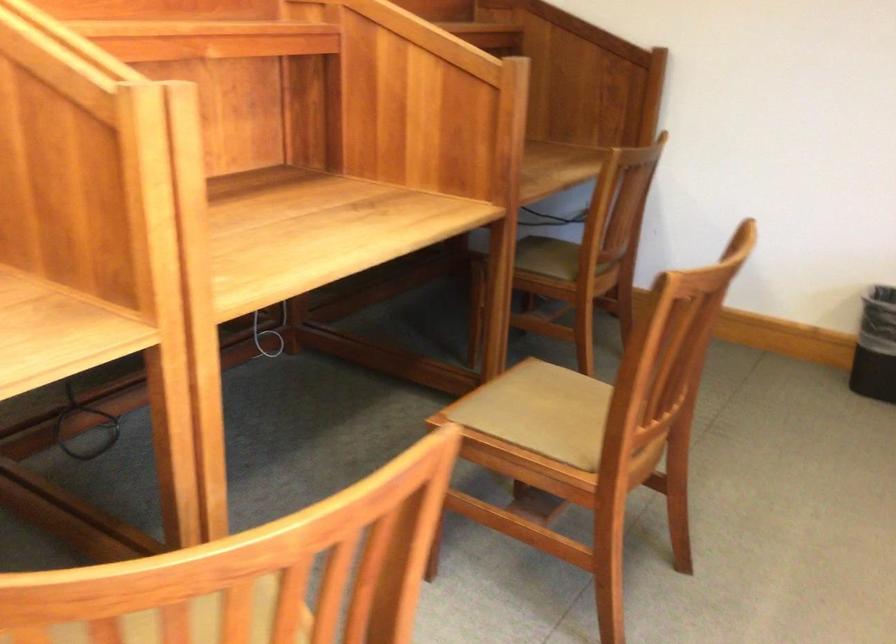
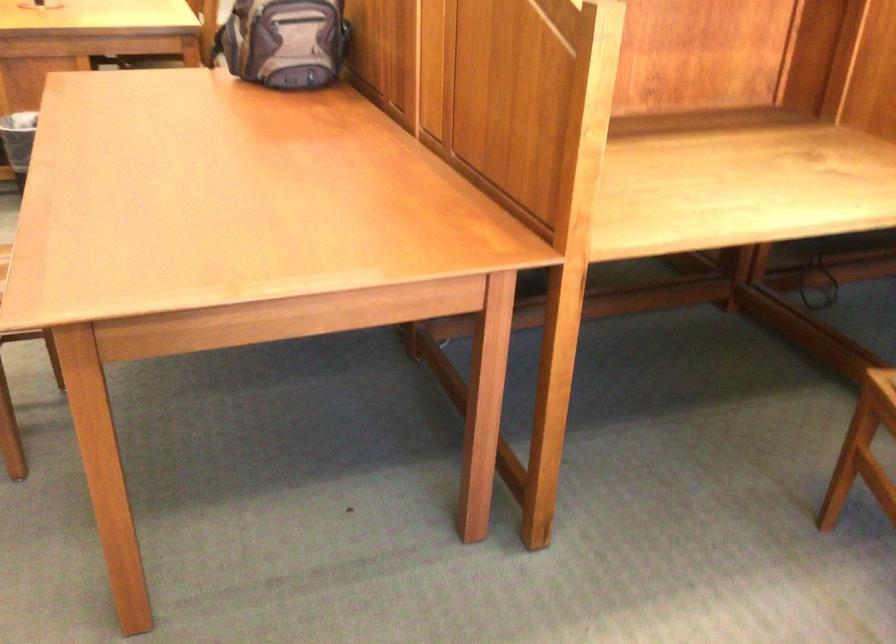
Question: The camera is either moving clockwise (left) or counter-clockwise (right) around the object. The first image is from the beginning of the video and the second image is from the end. Is the camera moving left or right when shooting the video?

Choices:
 (A) Left
 (B) Right

Answer: (B)